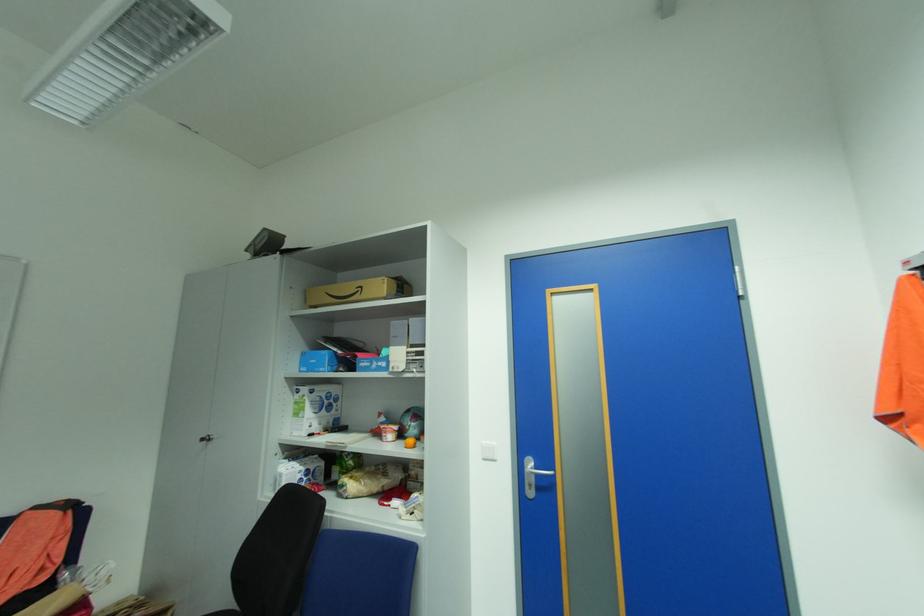
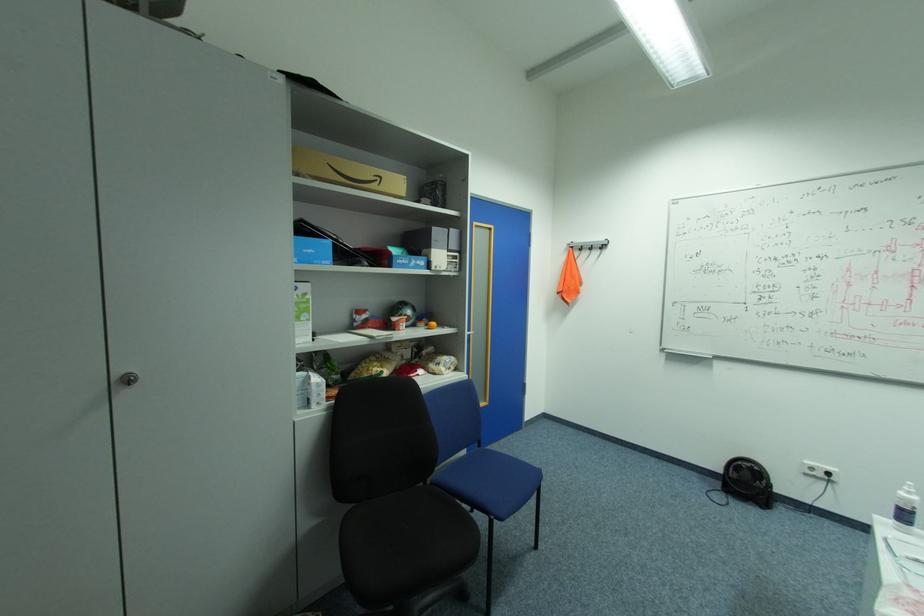
Find the pixel in the second image that matches the point at 368,286 in the first image.

(386, 177)